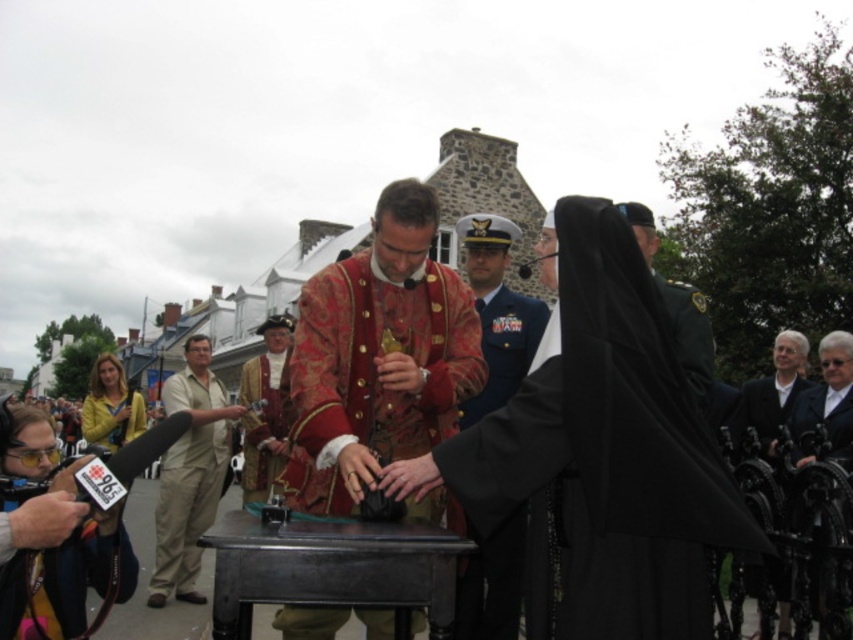
Question: Is shiny gold brocade coat at center below blue uniform at center?

Choices:
 (A) no
 (B) yes

Answer: (B)

Question: Among these points, which one is farthest from the camera?

Choices:
 (A) (190, 525)
 (B) (647, 259)
 (C) (573, 429)

Answer: (A)

Question: Is blue uniform at center above beige cotton shirt at center?

Choices:
 (A) yes
 (B) no

Answer: (A)

Question: Is blue uniform at center wider than beige cotton shirt at center?

Choices:
 (A) no
 (B) yes

Answer: (A)

Question: Which object is positioned farthest from the black leather jacket at right?

Choices:
 (A) green uniform at center
 (B) beige cotton shirt at center
 (C) blue uniform at center

Answer: (B)

Question: Which of the following is the closest to the observer?

Choices:
 (A) (753, 545)
 (B) (755, 392)
 (C) (700, 321)

Answer: (A)